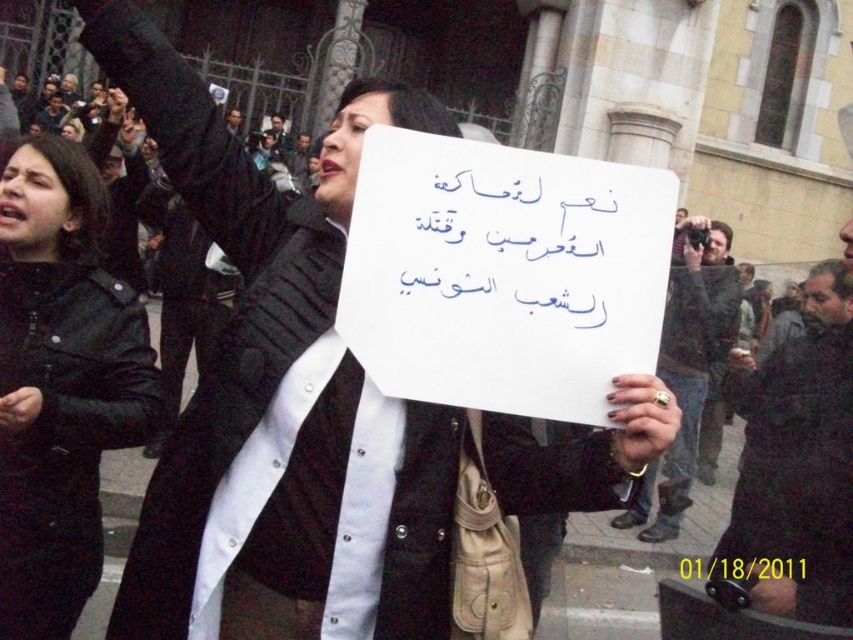
You are a photographer at the protest scene. You need to capture a clear photo of both the black matte coat at center and the black leather robe at center. Which object should you focus on first to ensure it appears larger in the photo?

The black matte coat at center is much taller than the black leather robe at center, so you should focus on the black matte coat at center first to ensure it appears larger in the photo.

You are a photographer standing at a certain distance from the central figure in the protest scene. You need to capture a clear photo of the black matte coat at center. Given that your camera has a minimum focus distance of 10 meters, will you be able to take a sharp photo of the coat?

The black matte coat at center and the viewer are 15.71 meters apart. Since the camera can focus as close as 10 meters, the distance of 15.71 meters is beyond the minimum focus distance requirement. Therefore, the photographer can take a sharp photo of the black matte coat at center.